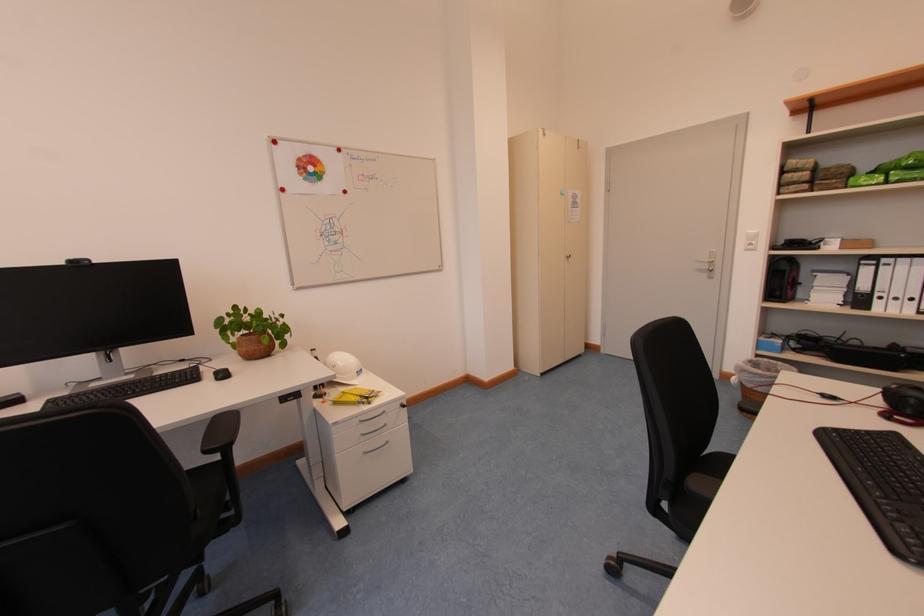
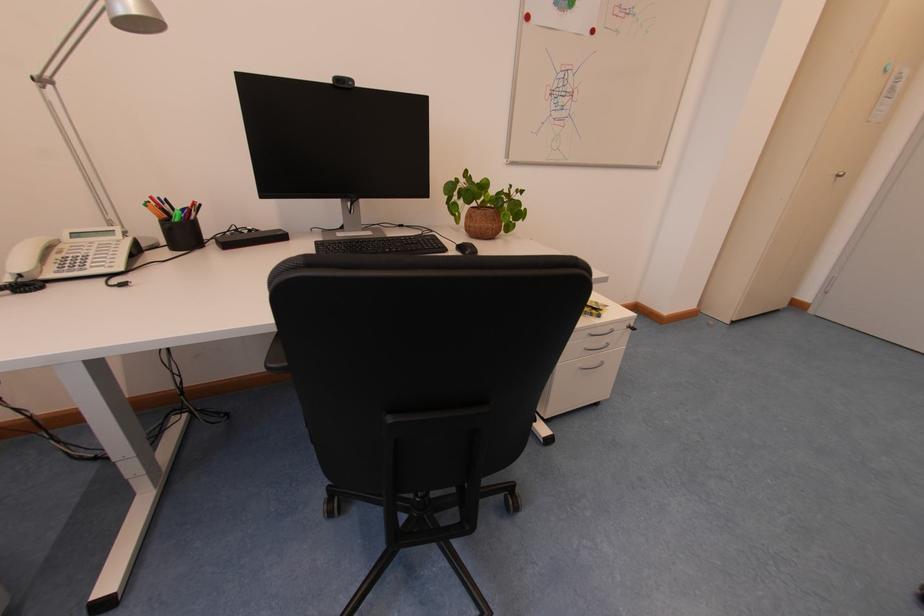
Question: The images are taken continuously from a first-person perspective. In which direction are you moving?

Choices:
 (A) Left
 (B) Right
 (C) Forward
 (D) Backward

Answer: (A)